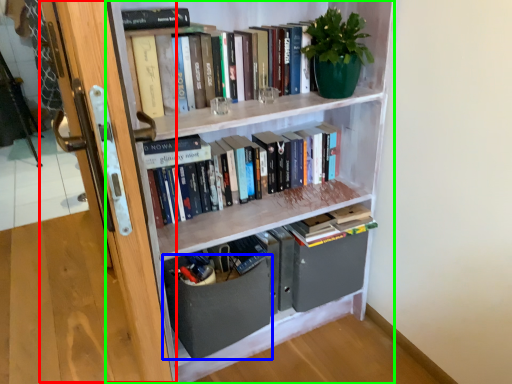
Question: Which object is positioned farthest from glass door (highlighted by a red box)? Select from drawer (highlighted by a blue box) and bookcase (highlighted by a green box).

Choices:
 (A) drawer
 (B) bookcase

Answer: (B)